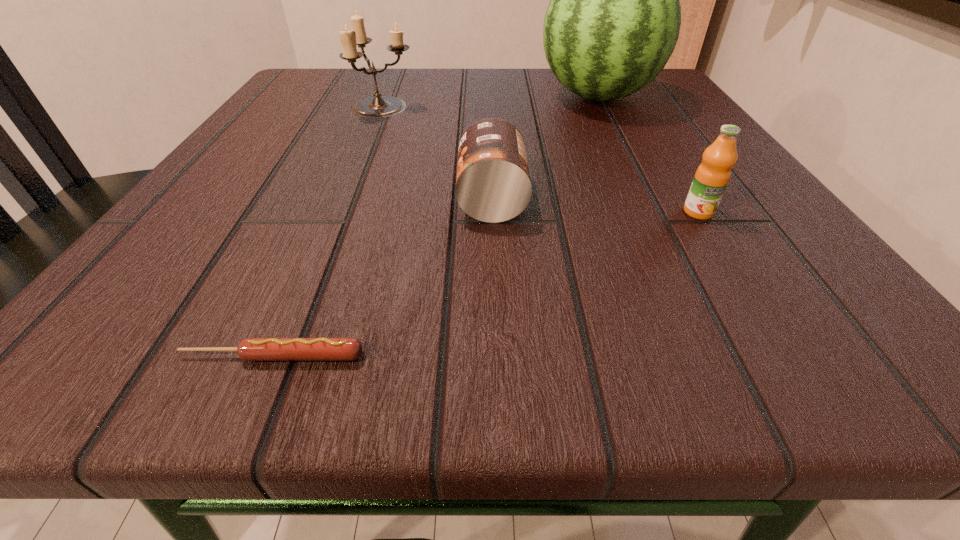
Image resolution: width=960 pixels, height=540 pixels. I want to click on the fourth closest object relative to the candle holder, so click(250, 349).

I want to click on object that is the second closest one to the tallest object, so [379, 106].